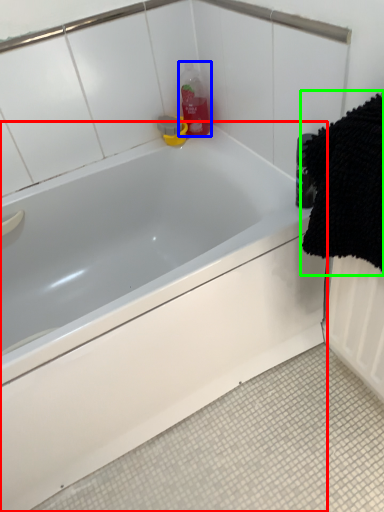
Question: Which is farther away from bathtub (highlighted by a red box)? cleaning product (highlighted by a blue box) or bath towel (highlighted by a green box)?

Choices:
 (A) cleaning product
 (B) bath towel

Answer: (A)